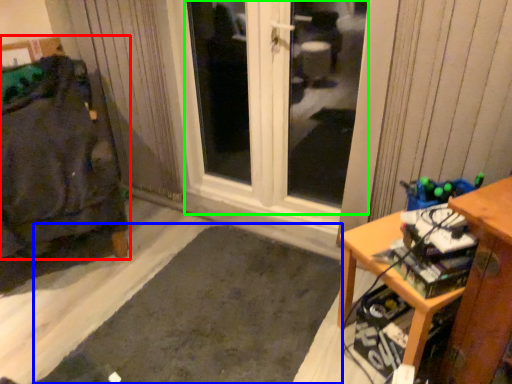
Question: Which object is positioned closest to furniture (highlighted by a red box)? Select from doormat (highlighted by a blue box) and window (highlighted by a green box).

Choices:
 (A) doormat
 (B) window

Answer: (A)